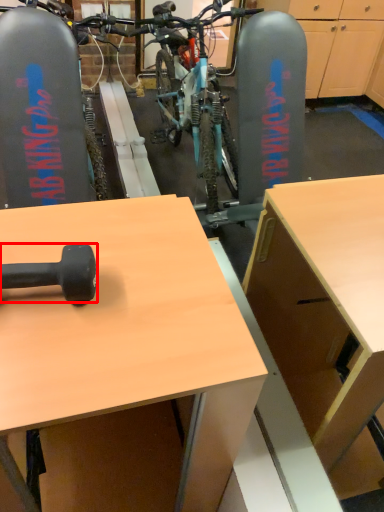
Question: From the image's perspective, where is dumbbell (annotated by the red box) located relative to desk?

Choices:
 (A) above
 (B) below

Answer: (A)